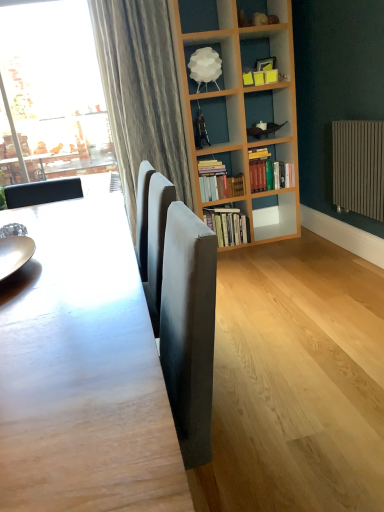
Question: From the image's perspective, would you say shiny metallic plate at left is positioned over hardcover books at center, the third book in the bottom-to-top sequence?

Choices:
 (A) no
 (B) yes

Answer: (A)

Question: Can you confirm if shiny metallic plate at left is smaller than hardcover books at center, which ranks as the 1th book in top-to-bottom order?

Choices:
 (A) no
 (B) yes

Answer: (B)

Question: Considering the relative sizes of shiny metallic plate at left and hardcover books at center, which ranks as the 1th book in top-to-bottom order, in the image provided, is shiny metallic plate at left thinner than hardcover books at center, which ranks as the 1th book in top-to-bottom order,?

Choices:
 (A) no
 (B) yes

Answer: (B)

Question: Is hardcover books at center, which ranks as the 1th book in top-to-bottom order, located within shiny metallic plate at left?

Choices:
 (A) yes
 (B) no

Answer: (B)

Question: Can you confirm if shiny metallic plate at left is positioned to the left of hardcover books at center, which ranks as the 1th book in top-to-bottom order?

Choices:
 (A) no
 (B) yes

Answer: (B)

Question: From the image's perspective, is smooth wooden table at center located above or below white matte lampshade at upper center?

Choices:
 (A) above
 (B) below

Answer: (B)

Question: Considering their positions, is smooth wooden table at center located in front of or behind white matte lampshade at upper center?

Choices:
 (A) behind
 (B) front

Answer: (B)

Question: Considering the relative positions of smooth wooden table at center and white matte lampshade at upper center in the image provided, is smooth wooden table at center to the left or to the right of white matte lampshade at upper center?

Choices:
 (A) left
 (B) right

Answer: (A)

Question: From their relative heights in the image, would you say smooth wooden table at center is taller or shorter than white matte lampshade at upper center?

Choices:
 (A) tall
 (B) short

Answer: (A)

Question: In terms of width, does smooth wooden table at center look wider or thinner when compared to hardcover books at center, the 3th book when ordered from top to bottom?

Choices:
 (A) thin
 (B) wide

Answer: (B)

Question: From a real-world perspective, is smooth wooden table at center positioned above or below hardcover books at center, the 3th book when ordered from top to bottom?

Choices:
 (A) below
 (B) above

Answer: (B)

Question: Would you say smooth wooden table at center is inside or outside hardcover books at center, the 3th book when ordered from top to bottom?

Choices:
 (A) inside
 (B) outside

Answer: (B)

Question: Considering their positions, is smooth wooden table at center located in front of or behind hardcover books at center, arranged as the first book when ordered from the bottom?

Choices:
 (A) behind
 (B) front

Answer: (B)

Question: Is brown metallic radiator at right wider or thinner than smooth wooden table at center?

Choices:
 (A) wide
 (B) thin

Answer: (B)

Question: Choose the correct answer: Is brown metallic radiator at right inside smooth wooden table at center or outside it?

Choices:
 (A) outside
 (B) inside

Answer: (A)